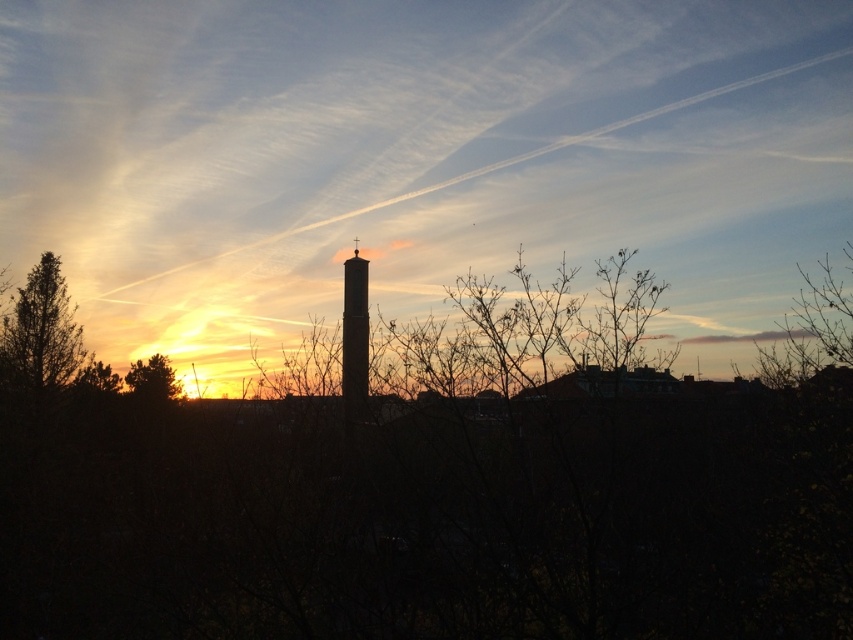
You are standing in the foreground of the sunset scene and want to touch the bare branches at right. Based on their position, which direction should you move to reach them?

The bare branches at right are located at point 0.514 on the horizontal axis and 0.953 on the vertical axis. Since the vertical coordinate is closer to 1, they are positioned higher up in the image. To reach them, you should move towards the upper right direction.

You are an architect designing a new garden layout. You want to place a decorative statue between the bare branches at right and the black matte chimney at center. Based on their heights, which object should the statue be placed closer to in order to maintain visual balance?

→ The statue should be placed closer to the bare branches at right since they are shorter than the black matte chimney at center, balancing their visual weight.